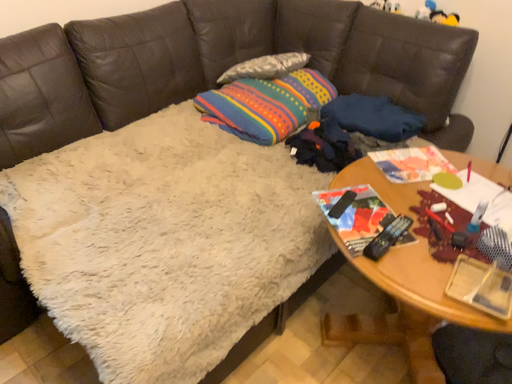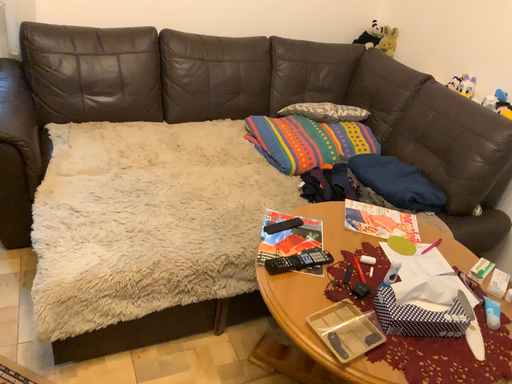
Question: Which way did the camera rotate in the video?

Choices:
 (A) rotated upward
 (B) rotated downward

Answer: (A)